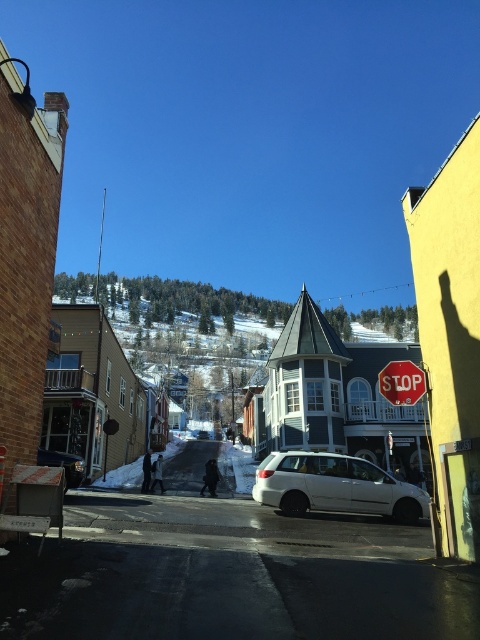
You are standing at the point labeled as point (336, 397) in the center of the street. Looking around, you see a white matte building at center. Which direction should you walk to reach the white matte building at center?

Since you are already at the point labeled as point (336, 397) which is the location of the white matte building at center, you are already there. No need to walk further.

You are standing on the street and want to walk towards both the point at coordinate (348, 508) and the point at coordinate (406, 403). Which point will you reach first?

You will reach the point at coordinate (348, 508) first because it is closer to you than the point at coordinate (406, 403).